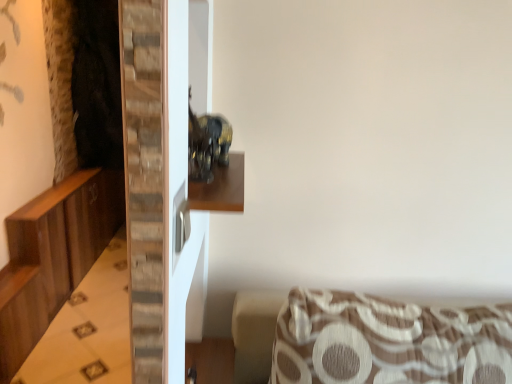
Question: Can you confirm if wooden dresser at left is shorter than brown textured cushion at lower right?

Choices:
 (A) yes
 (B) no

Answer: (A)

Question: Is wooden dresser at left far away from brown textured cushion at lower right?

Choices:
 (A) yes
 (B) no

Answer: (A)

Question: Is wooden dresser at left at the right side of brown textured cushion at lower right?

Choices:
 (A) no
 (B) yes

Answer: (A)

Question: Is wooden dresser at left bigger than brown textured cushion at lower right?

Choices:
 (A) no
 (B) yes

Answer: (B)

Question: Can you confirm if wooden dresser at left is positioned to the left of brown textured cushion at lower right?

Choices:
 (A) yes
 (B) no

Answer: (A)

Question: Is point coord(225,175) positioned closer to the camera than point coord(496,357)?

Choices:
 (A) farther
 (B) closer

Answer: (B)

Question: Is wooden shelf at center in front of or behind brown textured cushion at lower right in the image?

Choices:
 (A) front
 (B) behind

Answer: (A)

Question: Based on their positions, is wooden shelf at center located to the left or right of brown textured cushion at lower right?

Choices:
 (A) right
 (B) left

Answer: (B)

Question: From a real-world perspective, relative to brown textured cushion at lower right, is wooden shelf at center vertically above or below?

Choices:
 (A) below
 (B) above

Answer: (B)

Question: Considering the relative positions of brown textured cushion at lower right and wooden shelf at center in the image provided, is brown textured cushion at lower right to the left or to the right of wooden shelf at center?

Choices:
 (A) left
 (B) right

Answer: (B)

Question: In terms of size, does brown textured cushion at lower right appear bigger or smaller than wooden shelf at center?

Choices:
 (A) small
 (B) big

Answer: (B)

Question: From the image's perspective, is brown textured cushion at lower right positioned above or below wooden shelf at center?

Choices:
 (A) below
 (B) above

Answer: (A)

Question: Is brown textured cushion at lower right spatially inside wooden shelf at center, or outside of it?

Choices:
 (A) inside
 (B) outside

Answer: (B)

Question: Considering the positions of point (280, 355) and point (15, 337), is point (280, 355) closer or farther from the camera than point (15, 337)?

Choices:
 (A) farther
 (B) closer

Answer: (B)

Question: Looking at the image, does brown textured cushion at lower right seem bigger or smaller compared to wooden dresser at left?

Choices:
 (A) small
 (B) big

Answer: (A)